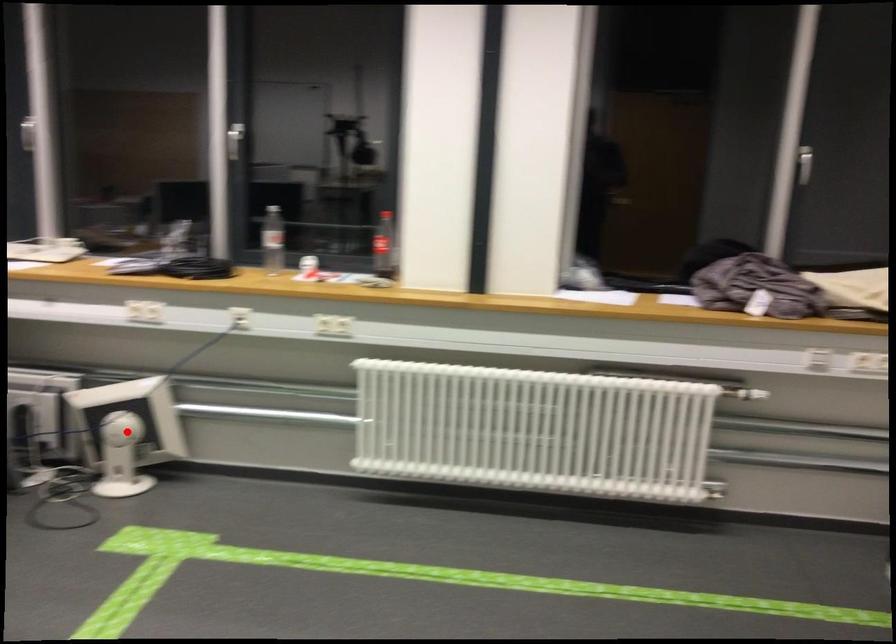
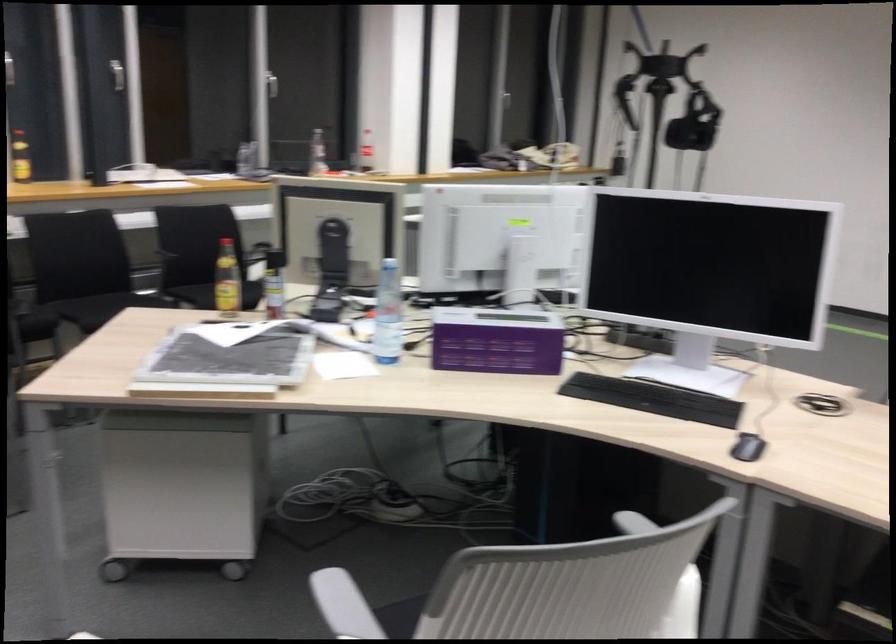
Question: I am providing you with two images of the same scene from different viewpoints. A red point is marked on the first image. Can you still see the location of the red point in image 2?

Choices:
 (A) Yes
 (B) No

Answer: (B)